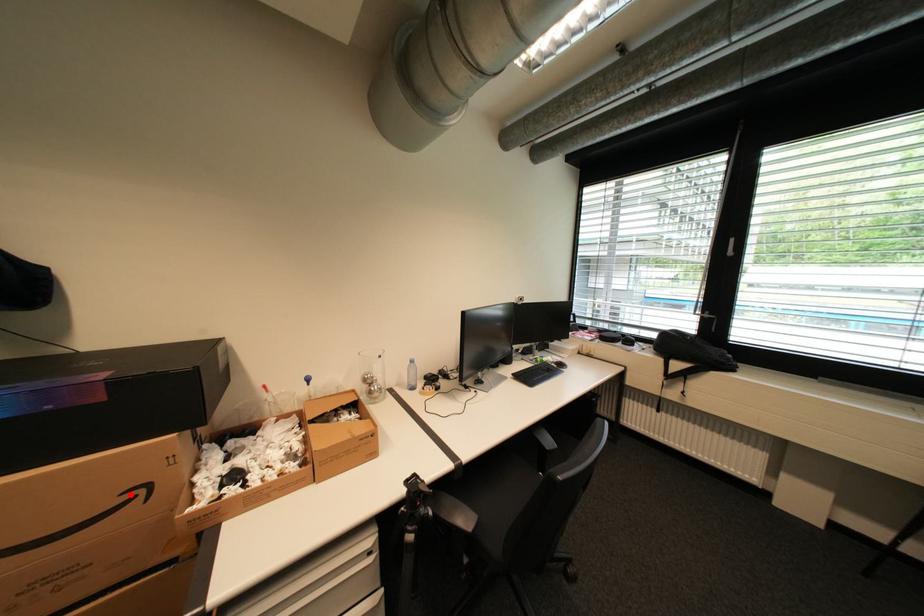
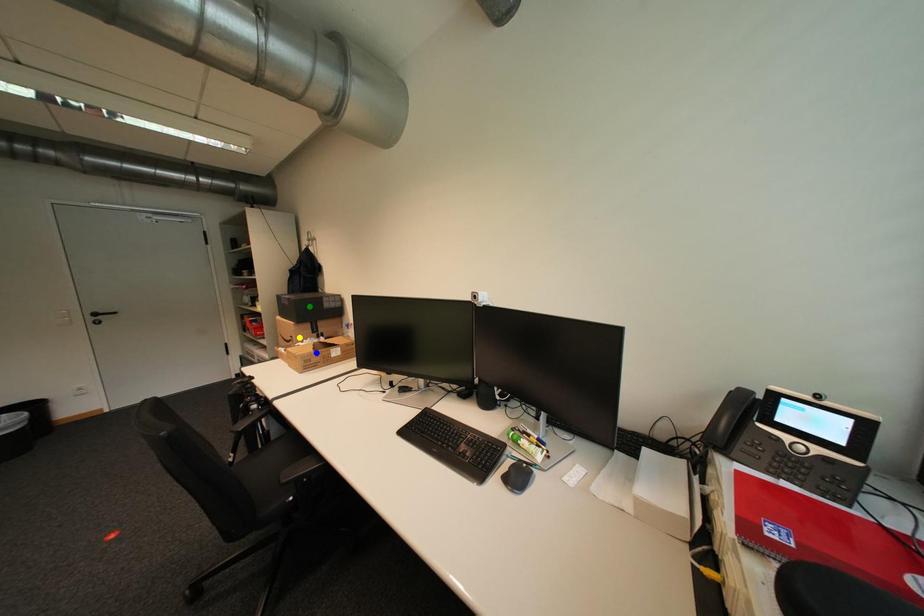
Question: I am providing you with two images of the same scene from different viewpoints. A red point is marked on the first image. You are given multiple points on the second image. Which spot in image 2 lines up with the point in image 1?

Choices:
 (A) yellow point
 (B) green point
 (C) blue point

Answer: (A)